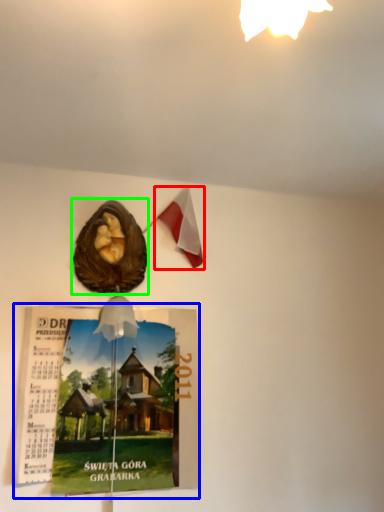
Question: Which object is positioned farthest from flag (highlighted by a red box)? Select from magazine (highlighted by a blue box) and flyer (highlighted by a green box).

Choices:
 (A) magazine
 (B) flyer

Answer: (A)